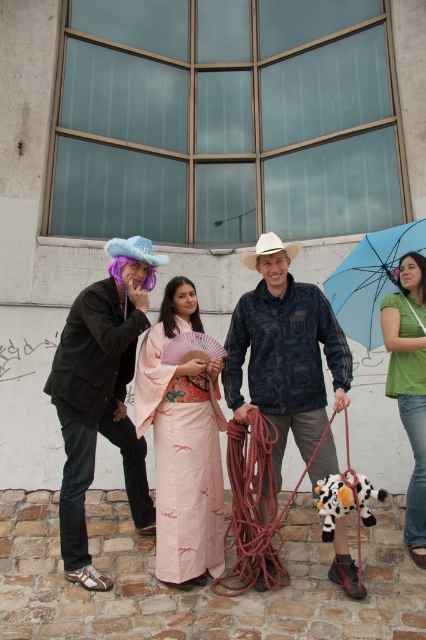
Which is more to the right, matte black jacket at left or pale pink silk kimono at center?

Positioned to the right is pale pink silk kimono at center.

Is point (135, 268) positioned before point (167, 506)?

No, it is behind (167, 506).

The height and width of the screenshot is (640, 426). In order to click on matte black jacket at left in this screenshot , I will do `click(100, 403)`.

What do you see at coordinates (100, 403) in the screenshot? I see `matte black jacket at left` at bounding box center [100, 403].

Is point (114, 348) positioned before point (290, 385)?

Yes, point (114, 348) is in front of point (290, 385).

At what (x,y) coordinates should I click in order to perform the action: click on matte black jacket at left. Please return your answer as a coordinate pair (x, y). Looking at the image, I should click on (100, 403).

Where is `matte black jacket at left`? This screenshot has height=640, width=426. matte black jacket at left is located at coordinates (100, 403).

Does point (374, 252) lie in front of point (333, 499)?

No, it is behind (333, 499).

Who is lower down, blue fabric umbrella at upper right or white plush cow at lower center?

Positioned lower is white plush cow at lower center.

The width and height of the screenshot is (426, 640). Find the location of `blue fabric umbrella at upper right`. blue fabric umbrella at upper right is located at coordinates (371, 280).